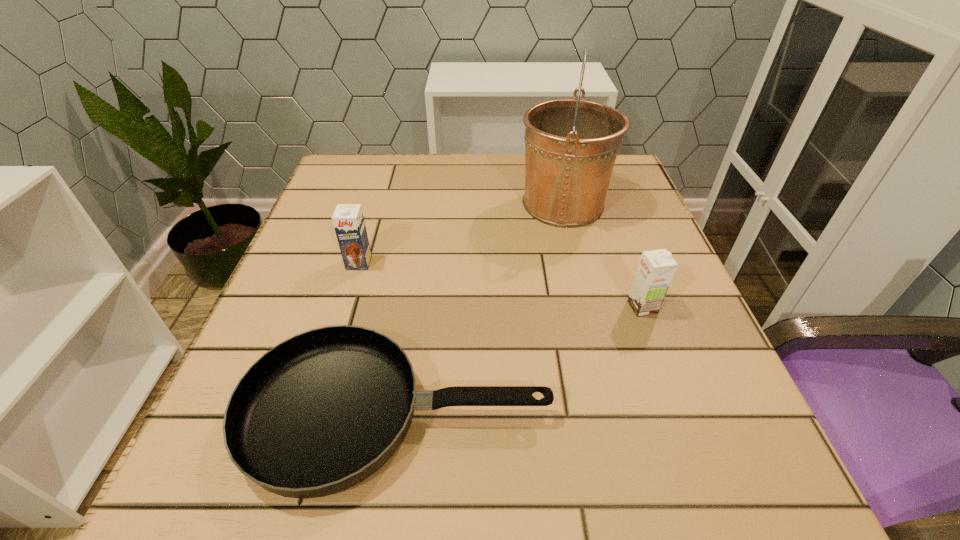
Where is `vacant area situated on the back of the second nearest object`? The width and height of the screenshot is (960, 540). vacant area situated on the back of the second nearest object is located at coordinates (611, 219).

Where is `vacant area situated at the end of the handle of the shortest object`? This screenshot has height=540, width=960. vacant area situated at the end of the handle of the shortest object is located at coordinates click(678, 414).

What are the coordinates of `object that is positioned at the far edge` in the screenshot? It's located at (571, 145).

The width and height of the screenshot is (960, 540). I want to click on object positioned at the near edge, so click(x=319, y=413).

Find the location of a particular element. This screenshot has width=960, height=540. chocolate milk that is at the left edge is located at coordinates (348, 220).

This screenshot has height=540, width=960. In order to click on frying pan that is at the left edge in this screenshot , I will do `click(319, 413)`.

Locate an element on the screen. This screenshot has width=960, height=540. bucket that is at the right edge is located at coordinates (571, 145).

Identify the location of chocolate milk at the right edge. Image resolution: width=960 pixels, height=540 pixels. (656, 268).

Find the location of a particular element. object that is at the near left corner is located at coordinates (319, 413).

I want to click on object that is at the far right corner, so click(x=571, y=145).